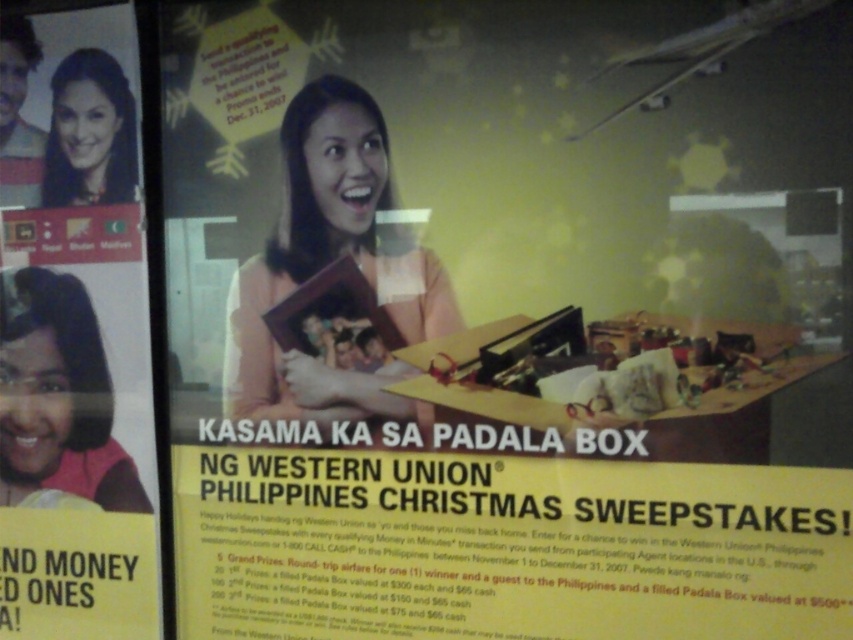
You are designing a poster and need to ensure that the matte pink shirt at left and the matte black hair at upper left are visible to viewers. Based on their sizes, which object should you prioritize placing in a more prominent position?

The matte pink shirt at left has a larger size compared to the matte black hair at upper left, so it should be prioritized in a more prominent position to ensure visibility.

Looking at the promotional poster for the Western Union Christmas Sweepstakes, you notice a smiling woman in the center. You also see the matte pink shirt at left and the matte black hair at upper left. Which object is positioned higher up on the poster?

The matte pink shirt at left is positioned higher up on the poster than the matte black hair at upper left because it is much taller as matte black hair at upper left.